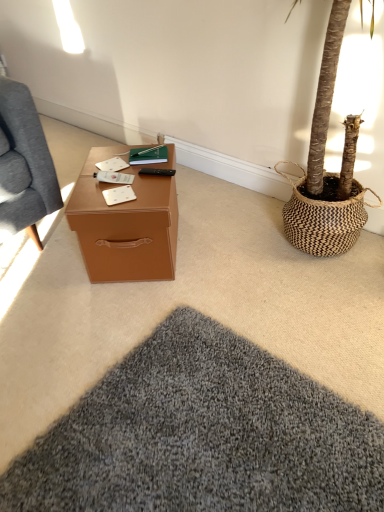
Identify the location of vacant space to the right of brown leather desk at center. This screenshot has height=512, width=384. (222, 245).